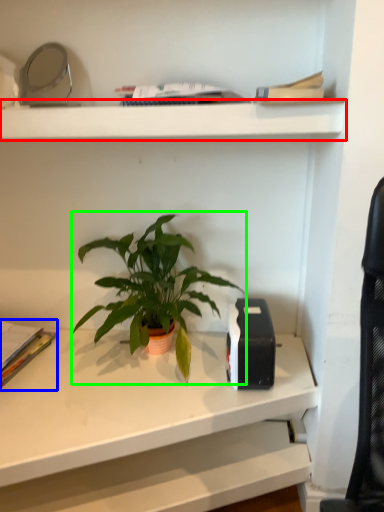
Question: Which object is the farthest from shelf (highlighted by a red box)? Choose among these: paperback book (highlighted by a blue box) or houseplant (highlighted by a green box).

Choices:
 (A) paperback book
 (B) houseplant

Answer: (A)